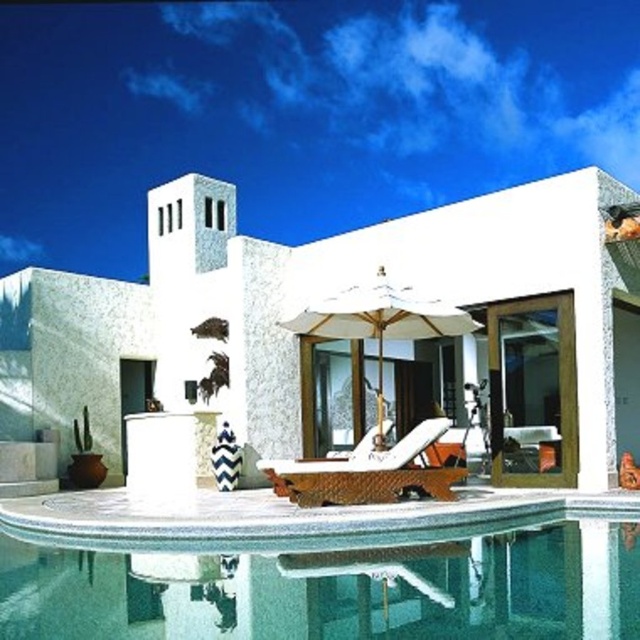
This screenshot has width=640, height=640. What do you see at coordinates (298, 308) in the screenshot?
I see `white textured villa at center` at bounding box center [298, 308].

Is white textured villa at center further to camera compared to clear glass pool at lower center?

Yes, it is.

Between point (454, 250) and point (163, 541), which one is positioned behind?

Positioned behind is point (454, 250).

Image resolution: width=640 pixels, height=640 pixels. Find the location of `white textured villa at center`. white textured villa at center is located at coordinates (298, 308).

In the scene shown: Between clear glass pool at lower center and brown woven daybed at center, which one has less height?

clear glass pool at lower center is shorter.

This screenshot has width=640, height=640. What do you see at coordinates (321, 566) in the screenshot?
I see `clear glass pool at lower center` at bounding box center [321, 566].

Measure the distance between clear glass pool at lower center and camera.

clear glass pool at lower center and camera are 6.35 meters apart.

Locate an element on the screen. The height and width of the screenshot is (640, 640). clear glass pool at lower center is located at coordinates (321, 566).

Is white textured villa at center thinner than white fabric umbrella at center?

Incorrect, white textured villa at center's width is not less than white fabric umbrella at center's.

Which of these two, white textured villa at center or white fabric umbrella at center, stands shorter?

With less height is white fabric umbrella at center.

This screenshot has height=640, width=640. I want to click on white textured villa at center, so click(298, 308).